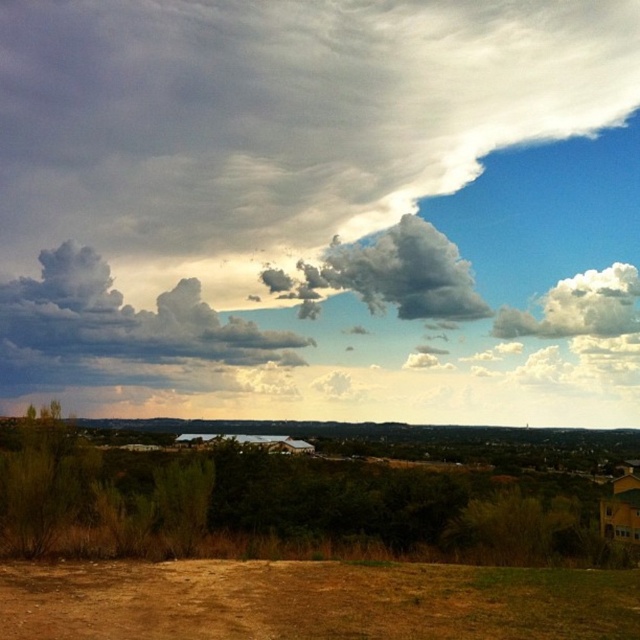
Does white fluffy cloud at upper center appear on the left side of clear glass lake at center?

No, white fluffy cloud at upper center is not to the left of clear glass lake at center.

Is point (493, 38) positioned in front of point (195, 436)?

No.

You are a GUI agent. You are given a task and a screenshot of the screen. Output one action in this format:
    pyautogui.click(x=<x>, y=<y>)
    Task: Click on the white fluffy cloud at upper center
    The image size is (640, 640).
    Given the screenshot: What is the action you would take?
    pyautogui.click(x=280, y=113)

Is brown dirt field at lower center wider than clear glass lake at center?

No, brown dirt field at lower center is not wider than clear glass lake at center.

How distant is brown dirt field at lower center from clear glass lake at center?

95.12 feet

The image size is (640, 640). What do you see at coordinates (312, 602) in the screenshot?
I see `brown dirt field at lower center` at bounding box center [312, 602].

Where is `brown dirt field at lower center`? brown dirt field at lower center is located at coordinates (312, 602).

Is white fluffy cloud at upper center below cloudy cotton at upper left?

No.

Between white fluffy cloud at upper center and cloudy cotton at upper left, which one appears on the right side from the viewer's perspective?

From the viewer's perspective, white fluffy cloud at upper center appears more on the right side.

The width and height of the screenshot is (640, 640). In order to click on white fluffy cloud at upper center in this screenshot , I will do `click(280, 113)`.